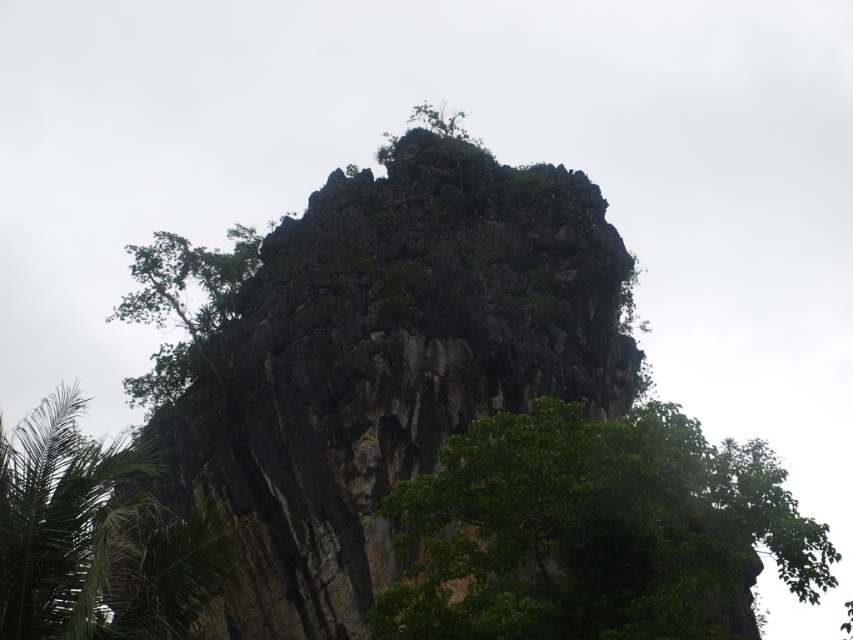
Which of these two, green leafy palm tree at lower left or green leafy tree at upper left, stands shorter?

green leafy palm tree at lower left

Does green leafy palm tree at lower left have a larger size compared to green leafy tree at upper left?

Indeed, green leafy palm tree at lower left has a larger size compared to green leafy tree at upper left.

Which is behind, point (177, 624) or point (193, 364)?

Positioned behind is point (193, 364).

Image resolution: width=853 pixels, height=640 pixels. I want to click on green leafy palm tree at lower left, so click(99, 540).

Which is behind, point (247, 372) or point (149, 410)?

The point (149, 410) is more distant.

You are a GUI agent. You are given a task and a screenshot of the screen. Output one action in this format:
    pyautogui.click(x=<x>, y=<y>)
    Task: Click on the dark rock formation at center
    Image resolution: width=853 pixels, height=640 pixels.
    Given the screenshot: What is the action you would take?
    pyautogui.click(x=387, y=362)

Is point (706, 483) farther from camera compared to point (141, 394)?

That is False.

The image size is (853, 640). What do you see at coordinates (593, 531) in the screenshot?
I see `green leafy tree at center` at bounding box center [593, 531].

Who is more distant from viewer, (689,632) or (215,288)?

The point (215,288) is more distant.

You are a GUI agent. You are given a task and a screenshot of the screen. Output one action in this format:
    pyautogui.click(x=<x>, y=<y>)
    Task: Click on the green leafy tree at center
    This screenshot has height=640, width=853.
    Given the screenshot: What is the action you would take?
    pyautogui.click(x=593, y=531)